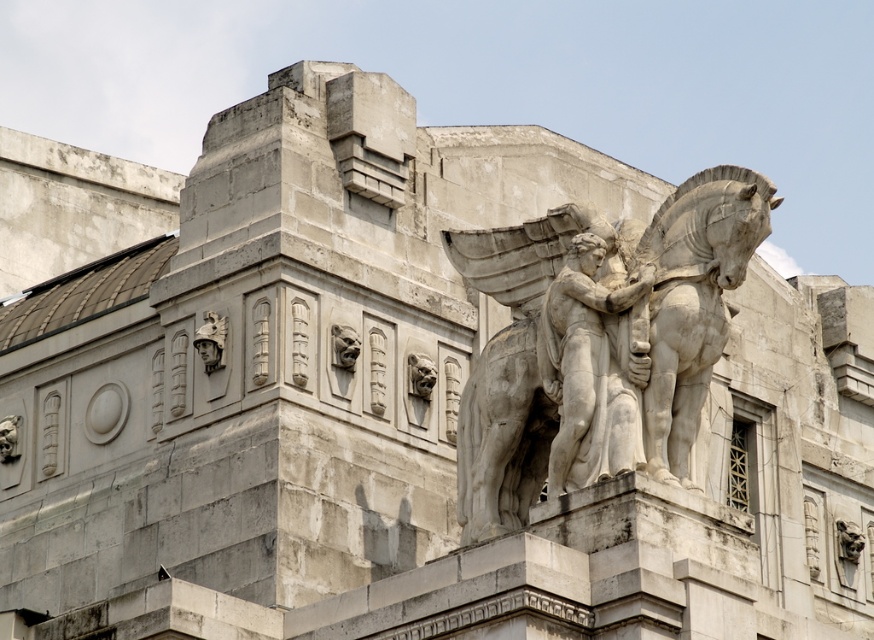
Question: Which point is closer to the camera?

Choices:
 (A) white marble statue at upper right
 (B) white marble angel at center

Answer: (A)

Question: Which object is farther from the camera taking this photo?

Choices:
 (A) white marble angel at center
 (B) white marble statue at upper right

Answer: (A)

Question: Is white marble statue at upper right bigger than white marble angel at center?

Choices:
 (A) yes
 (B) no

Answer: (A)

Question: Which point appears closest to the camera in this image?

Choices:
 (A) (558, 408)
 (B) (567, 465)

Answer: (B)

Question: Is white marble statue at upper right above white marble angel at center?

Choices:
 (A) no
 (B) yes

Answer: (B)

Question: Is white marble statue at upper right bigger than white marble angel at center?

Choices:
 (A) no
 (B) yes

Answer: (B)